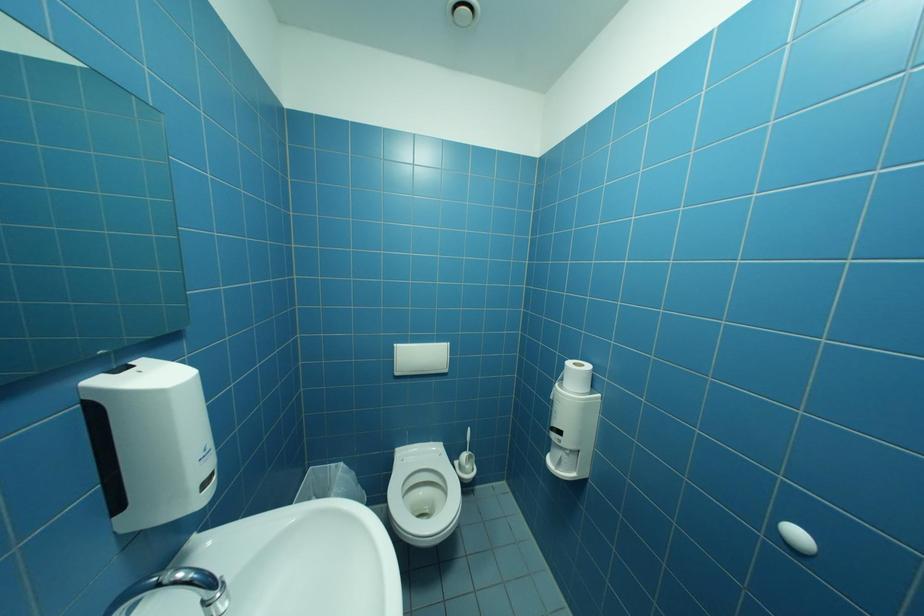
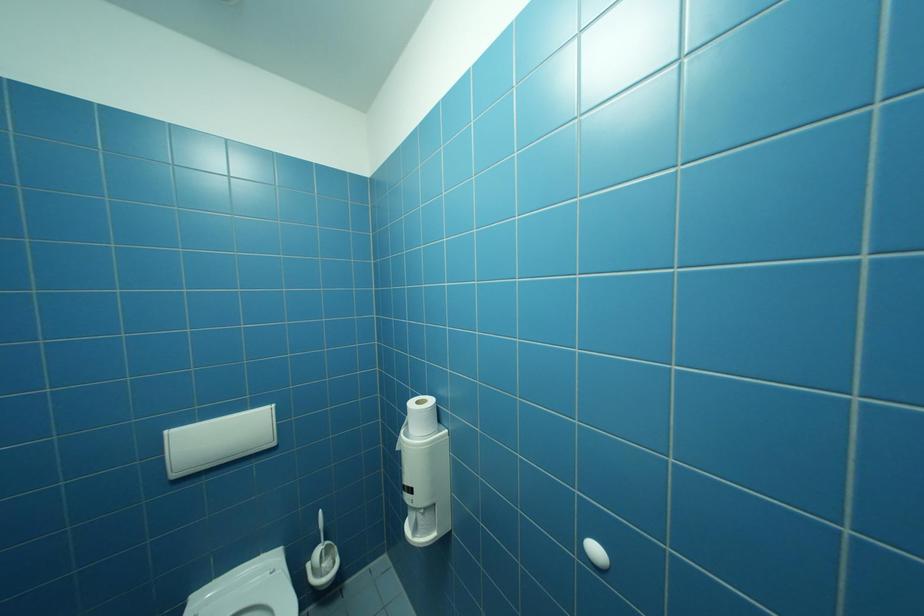
Question: Based on the continuous images, in which direction is the camera rotating? Reply with the corresponding letter.

Choices:
 (A) Left
 (B) Right
 (C) Up
 (D) Down

Answer: (B)